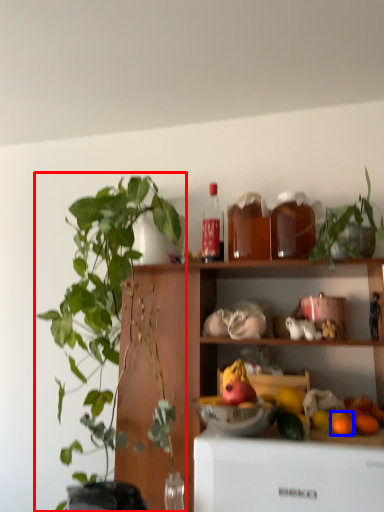
Question: Among these objects, which one is nearest to the camera, houseplant (highlighted by a red box) or orange (highlighted by a blue box)?

Choices:
 (A) houseplant
 (B) orange

Answer: (A)